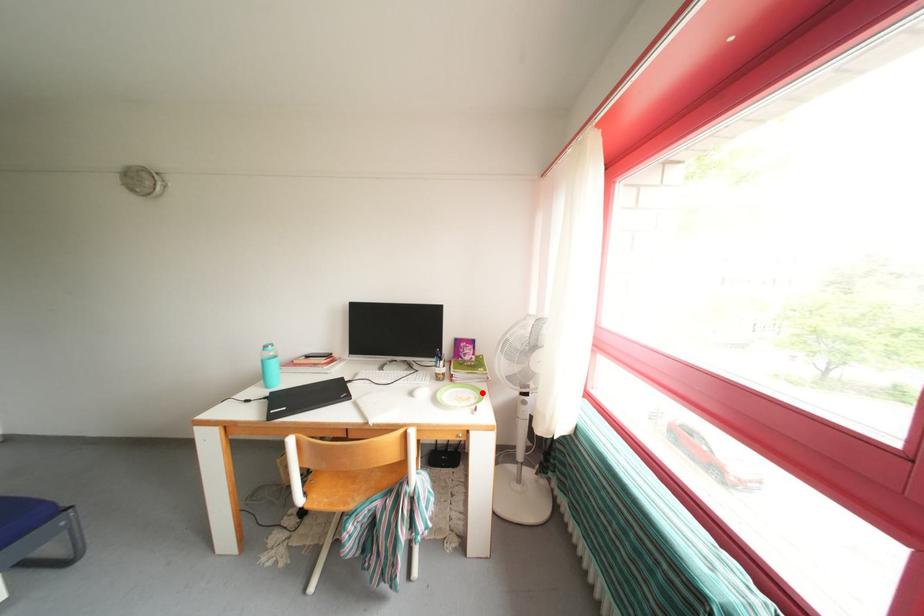
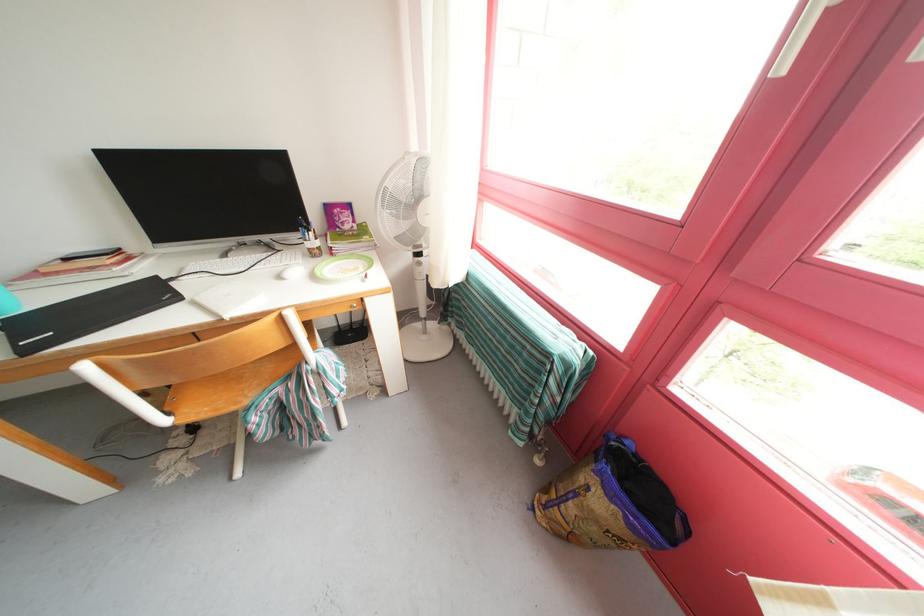
Find the pixel in the second image that matches the highlighted location in the first image.

(369, 262)